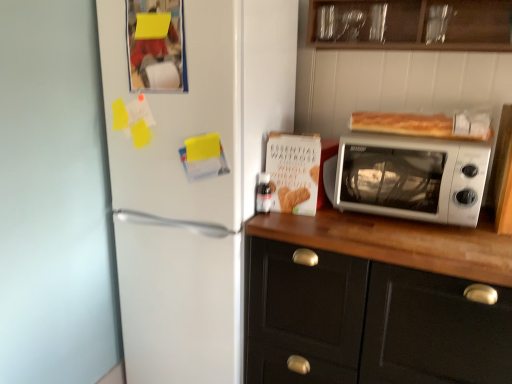
Question: Should I look upward or downward to see white plastic microwave at upper right?

Choices:
 (A) up
 (B) down

Answer: (A)

Question: Is white matte cabinet at right, arranged as the 2th cabinetry when viewed from the top, facing away from white matte refrigerator at left?

Choices:
 (A) yes
 (B) no

Answer: (B)

Question: Considering the relative sizes of white matte cabinet at right, arranged as the 2th cabinetry when viewed from the top, and white matte refrigerator at left in the image provided, is white matte cabinet at right, arranged as the 2th cabinetry when viewed from the top, wider than white matte refrigerator at left?

Choices:
 (A) yes
 (B) no

Answer: (B)

Question: From a real-world perspective, is white matte cabinet at right, positioned as the 1th cabinetry in bottom-to-top order, positioned under white matte refrigerator at left based on gravity?

Choices:
 (A) no
 (B) yes

Answer: (B)

Question: Does white matte cabinet at right, arranged as the 2th cabinetry when viewed from the top, have a smaller size compared to white matte refrigerator at left?

Choices:
 (A) yes
 (B) no

Answer: (A)

Question: Is white matte cabinet at right, positioned as the 1th cabinetry in bottom-to-top order, at the left side of white matte refrigerator at left?

Choices:
 (A) no
 (B) yes

Answer: (A)

Question: From a real-world perspective, does white matte cabinet at right, arranged as the 2th cabinetry when viewed from the top, stand above white matte refrigerator at left?

Choices:
 (A) yes
 (B) no

Answer: (B)

Question: Does golden brown crusty bread at upper right have a lesser width compared to white matte cabinet at right, arranged as the 2th cabinetry when viewed from the top?

Choices:
 (A) no
 (B) yes

Answer: (B)

Question: Is golden brown crusty bread at upper right positioned in front of white matte cabinet at right, arranged as the 2th cabinetry when viewed from the top?

Choices:
 (A) no
 (B) yes

Answer: (A)

Question: From the image's perspective, would you say golden brown crusty bread at upper right is shown under white matte cabinet at right, positioned as the 1th cabinetry in bottom-to-top order?

Choices:
 (A) no
 (B) yes

Answer: (A)

Question: Is golden brown crusty bread at upper right surrounding white matte cabinet at right, arranged as the 2th cabinetry when viewed from the top?

Choices:
 (A) no
 (B) yes

Answer: (A)

Question: From a real-world perspective, is golden brown crusty bread at upper right located higher than white matte cabinet at right, positioned as the 1th cabinetry in bottom-to-top order?

Choices:
 (A) yes
 (B) no

Answer: (A)

Question: Considering the relative positions of golden brown crusty bread at upper right and white matte cabinet at right, arranged as the 2th cabinetry when viewed from the top, in the image provided, is golden brown crusty bread at upper right to the left of white matte cabinet at right, arranged as the 2th cabinetry when viewed from the top, from the viewer's perspective?

Choices:
 (A) yes
 (B) no

Answer: (B)

Question: From a real-world perspective, is white plastic microwave at upper right below wooden cabinet at upper center, arranged as the second cabinetry when ordered from the bottom?

Choices:
 (A) no
 (B) yes

Answer: (B)